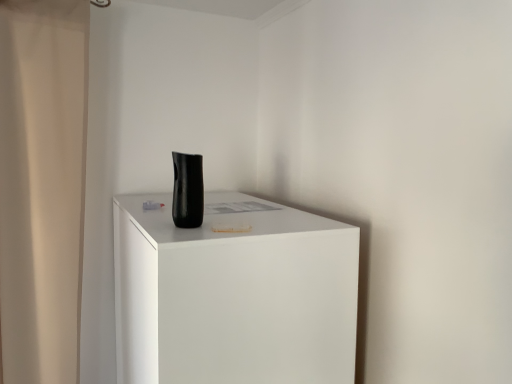
Find the location of `free space to the left of black matte vase at center`. free space to the left of black matte vase at center is located at coordinates (152, 224).